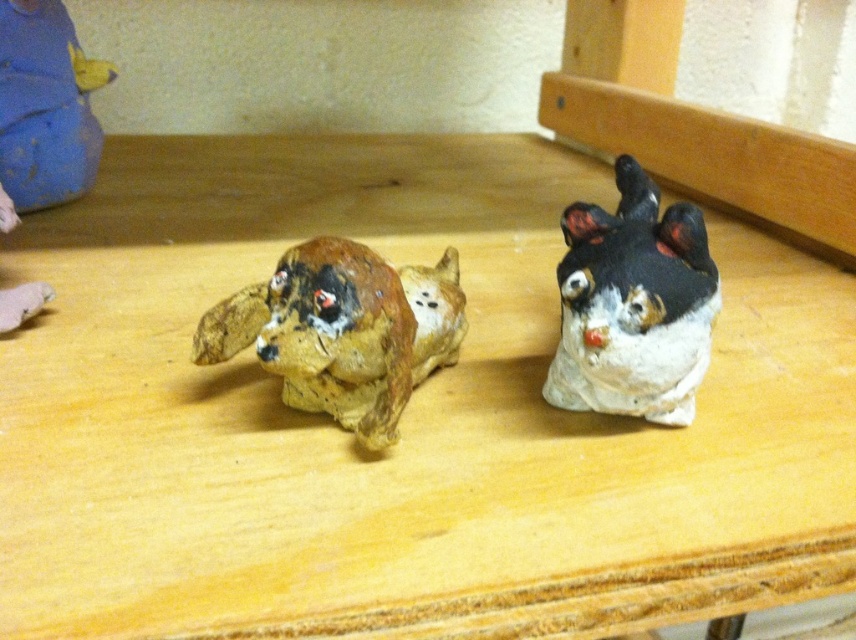
You are an art curator arranging an exhibition. You need to place a label next to the brown matte dog at left. The label must be placed at coordinates exactly 1 unit to the right of the dog. What are the coordinates where you should place the label?

The coordinates for the label should be calculated by adding 1 to the x coordinate of the brown matte dog at left. The original position is at point (343,330), so the new coordinates would be (343,639).

You are trying to place a new decorative item between the speckled clay cat at right and the matte blue plush at upper left. What is the minimum length of the item needed to fit exactly between them?

The minimum length of the item needed to fit exactly between the speckled clay cat at right and the matte blue plush at upper left is 3.44 feet.

You are a delivery person who needs to place a new package between the brown matte dog at left and the speckled clay cat at right on the wooden surface. The package measures 9 inches in length. Will there be enough space between them to fit the package without moving either figurine?

The brown matte dog at left is 10.02 inches away from the speckled clay cat at right. Since the package is 9 inches long, there is sufficient space between them to fit the package without moving either figurine.